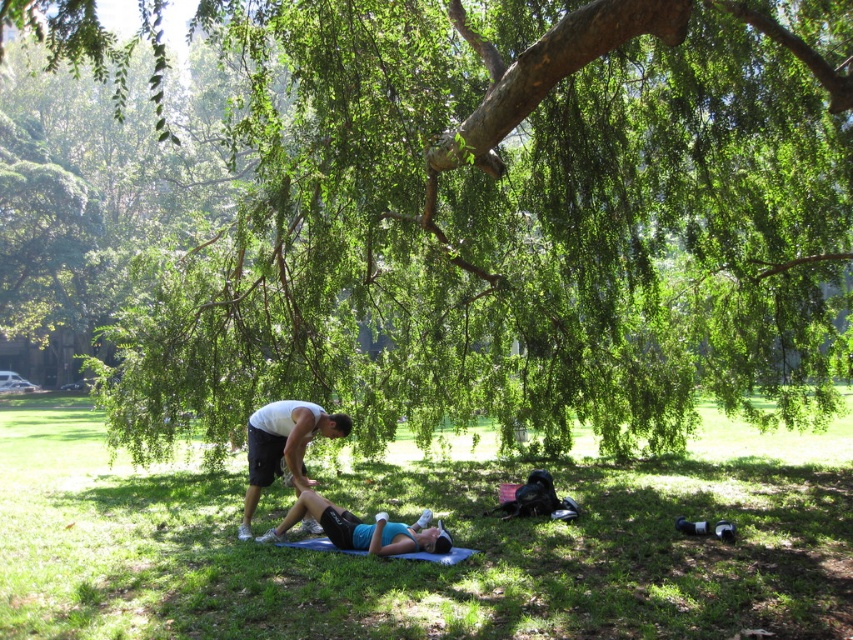
You are standing in the park and see two points marked in the scene. Which point is closer to you, point (x=157, y=540) or point (x=387, y=531)?

Point (x=157, y=540) is closer to you because it is further to the viewer than point (x=387, y=531).

You are a photographer positioned to the side of the scene. You need to capture a photo where both the matte white shirt at center and the blue fabric mat at lower center are clearly visible. Given their positions, which object should you ensure stays within the camera frame first?

The blue fabric mat at lower center is behind the matte white shirt at center, so you should ensure the matte white shirt at center stays within the camera frame first to avoid blocking the view of the blue fabric mat at lower center.